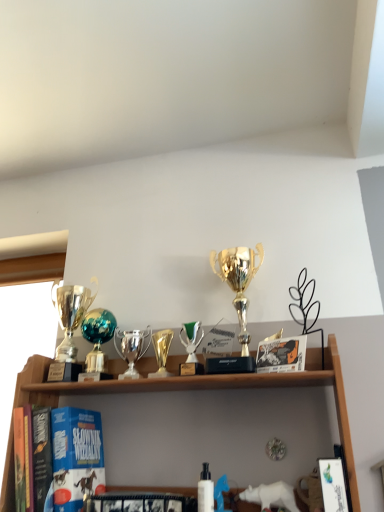
Question: Is gold metallic trophy at center turned away from white glossy book at lower right, the 1th book positioned from the right?

Choices:
 (A) yes
 (B) no

Answer: (B)

Question: From a real-world perspective, is gold metallic trophy at center located beneath white glossy book at lower right, which is counted as the 2th book, starting from the back?

Choices:
 (A) yes
 (B) no

Answer: (B)

Question: Does gold metallic trophy at center have a greater height compared to white glossy book at lower right, the second book viewed from the left?

Choices:
 (A) no
 (B) yes

Answer: (A)

Question: From the image's perspective, does gold metallic trophy at center appear lower than white glossy book at lower right, acting as the 1th book starting from the front?

Choices:
 (A) no
 (B) yes

Answer: (A)

Question: Can you confirm if gold metallic trophy at center is thinner than white glossy book at lower right, acting as the 1th book starting from the front?

Choices:
 (A) no
 (B) yes

Answer: (A)

Question: Based on their sizes in the image, would you say gold shiny trophy at center, the 1th trophy in the right-to-left sequence, is bigger or smaller than green metallic trophy at center, the 4th trophy viewed from the left?

Choices:
 (A) small
 (B) big

Answer: (B)

Question: Is gold shiny trophy at center, which is the fifth trophy in left-to-right order, taller or shorter than green metallic trophy at center, the 4th trophy viewed from the left?

Choices:
 (A) short
 (B) tall

Answer: (B)

Question: Considering the positions of point (220, 251) and point (188, 332), is point (220, 251) closer or farther from the camera than point (188, 332)?

Choices:
 (A) closer
 (B) farther

Answer: (B)

Question: Considering the relative positions of gold shiny trophy at center, which is the fifth trophy in left-to-right order, and green metallic trophy at center, marked as the second trophy in a right-to-left arrangement, in the image provided, is gold shiny trophy at center, which is the fifth trophy in left-to-right order, to the left or to the right of green metallic trophy at center, marked as the second trophy in a right-to-left arrangement,?

Choices:
 (A) right
 (B) left

Answer: (A)

Question: Do you think gold metallic trophy at center is within gold shiny trophy at center, which is the fifth trophy in left-to-right order, or outside of it?

Choices:
 (A) inside
 (B) outside

Answer: (B)

Question: In the image, is gold metallic trophy at center positioned in front of or behind gold shiny trophy at center, which is the fifth trophy in left-to-right order?

Choices:
 (A) behind
 (B) front

Answer: (A)

Question: Is gold metallic trophy at center taller or shorter than gold shiny trophy at center, the 1th trophy in the right-to-left sequence?

Choices:
 (A) tall
 (B) short

Answer: (B)

Question: In terms of size, does gold metallic trophy at center appear bigger or smaller than gold shiny trophy at center, which is the fifth trophy in left-to-right order?

Choices:
 (A) big
 (B) small

Answer: (B)

Question: Choose the correct answer: Is gold metallic trophy at center inside white glossy book at lower right, acting as the 1th book starting from the front, or outside it?

Choices:
 (A) inside
 (B) outside

Answer: (B)

Question: In terms of height, does gold metallic trophy at center look taller or shorter compared to white glossy book at lower right, which is counted as the 2th book, starting from the back?

Choices:
 (A) short
 (B) tall

Answer: (A)